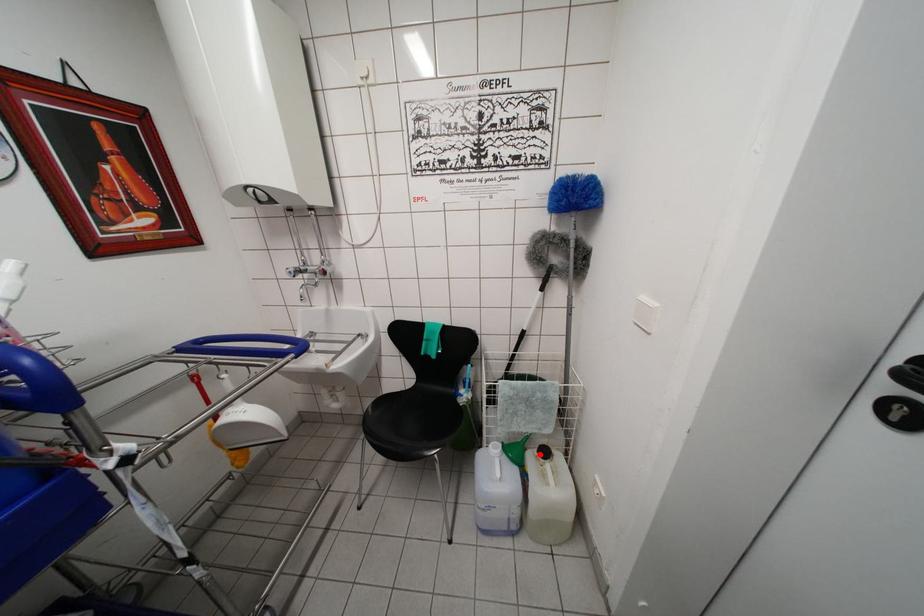
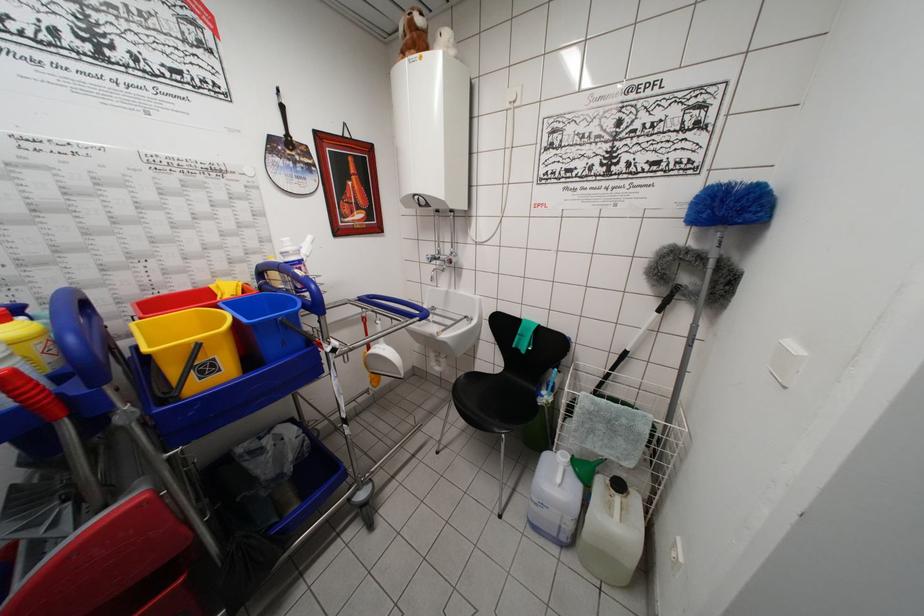
Locate, in the second image, the point that corresponds to the highlighted location in the first image.

(614, 483)